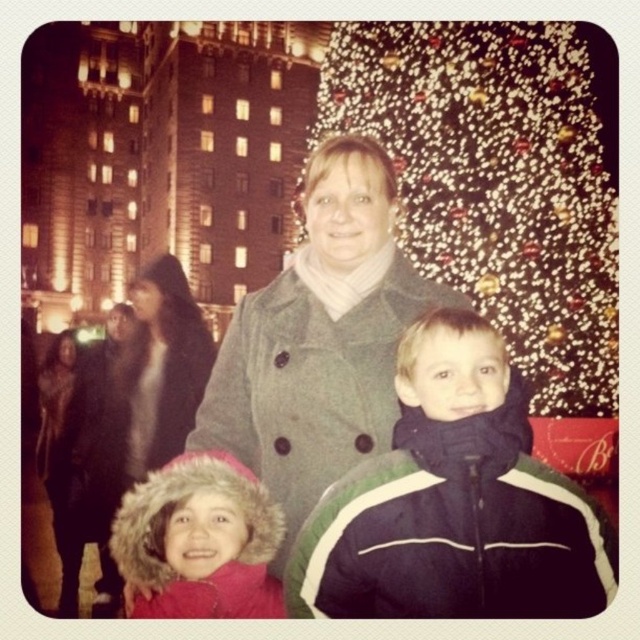
Question: Can you confirm if green and white jacket at center is positioned above fuzzy pink coat at lower left?

Choices:
 (A) no
 (B) yes

Answer: (B)

Question: Does gray wool coat at center come behind black fur coat at left?

Choices:
 (A) yes
 (B) no

Answer: (B)

Question: Can you confirm if fuzzy pink coat at lower left is smaller than fuzzy black coat at center?

Choices:
 (A) no
 (B) yes

Answer: (A)

Question: Which of the following is the closest to the observer?

Choices:
 (A) (440, 468)
 (B) (595, 163)
 (C) (164, 355)
 (D) (385, 368)

Answer: (A)

Question: Which point is closer to the camera taking this photo?

Choices:
 (A) (467, 557)
 (B) (67, 410)

Answer: (A)

Question: Among these points, which one is farthest from the camera?

Choices:
 (A) (355, 602)
 (B) (250, 374)

Answer: (B)